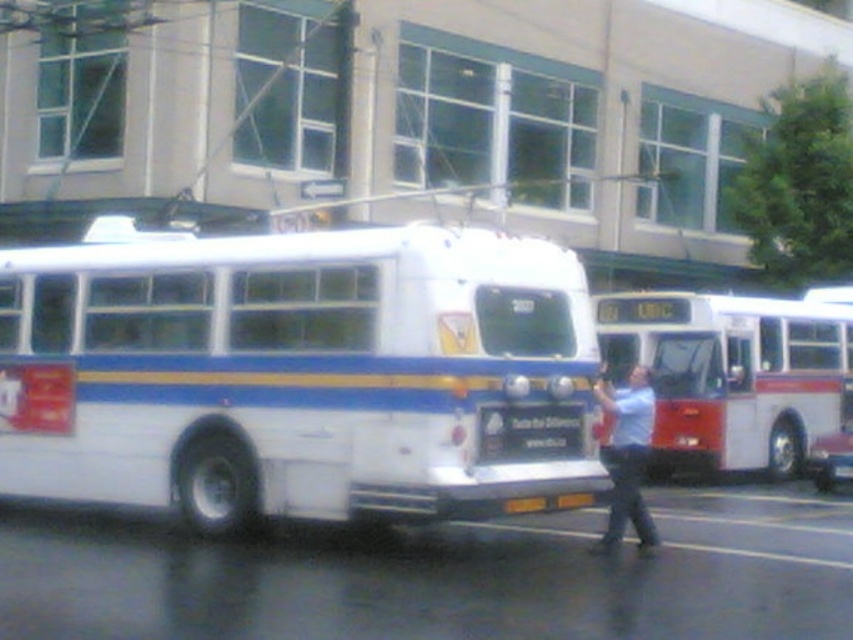
Question: Can you confirm if white matte bus at center is thinner than black plastic sign at center?

Choices:
 (A) yes
 (B) no

Answer: (A)

Question: Which point is closer to the camera?

Choices:
 (A) (730, 374)
 (B) (492, 412)
 (C) (167, 365)

Answer: (B)

Question: Can you confirm if red matte bus at center is positioned to the left of black plastic sign at center?

Choices:
 (A) yes
 (B) no

Answer: (B)

Question: Which point is closer to the camera?

Choices:
 (A) black plastic sign at center
 (B) white matte bus at center

Answer: (B)

Question: Which object is positioned farthest from the black plastic sign at center?

Choices:
 (A) red matte bus at center
 (B) white matte bus at center

Answer: (A)

Question: Does white matte bus at center lie behind red matte bus at center?

Choices:
 (A) yes
 (B) no

Answer: (B)